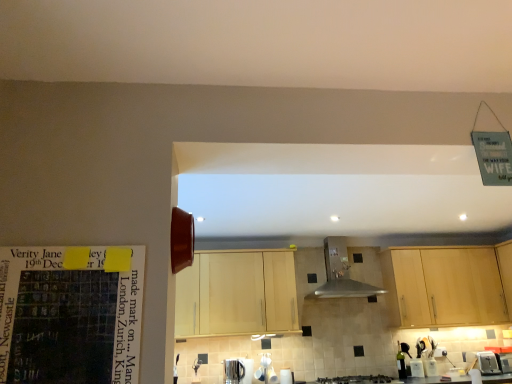
At what (x,y) coordinates should I click in order to perform the action: click on free spot above stainless steel vent at center (from a real-world perspective). Please return your answer as a coordinate pair (x, y). Looking at the image, I should click on (336, 234).